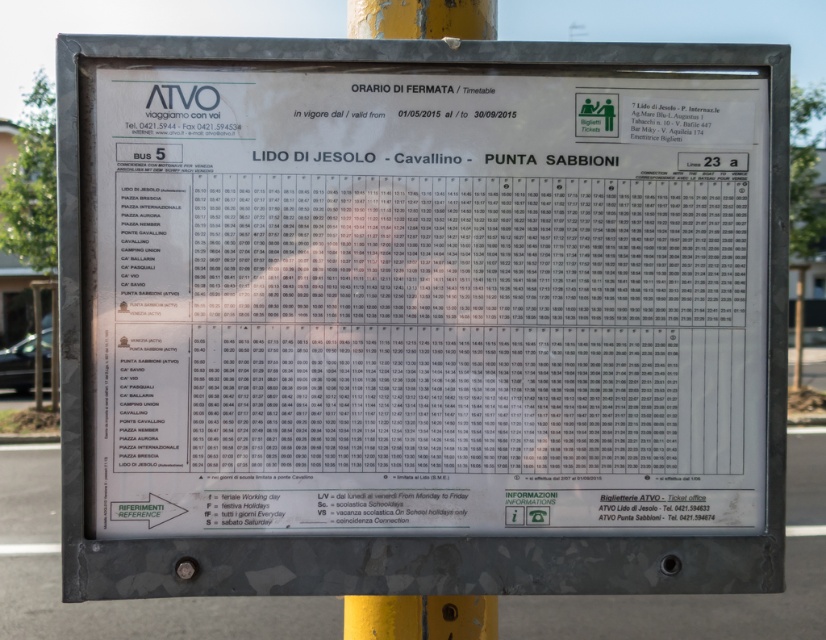
Question: Which of the following is the closest to the observer?

Choices:
 (A) (407, 596)
 (B) (648, 465)

Answer: (B)

Question: Does white paper timetable at center have a smaller size compared to yellow painted metal pole at upper center?

Choices:
 (A) no
 (B) yes

Answer: (A)

Question: Does white paper timetable at center have a smaller size compared to yellow painted metal pole at upper center?

Choices:
 (A) no
 (B) yes

Answer: (A)

Question: Can you confirm if white paper timetable at center is positioned below yellow painted metal pole at upper center?

Choices:
 (A) no
 (B) yes

Answer: (A)